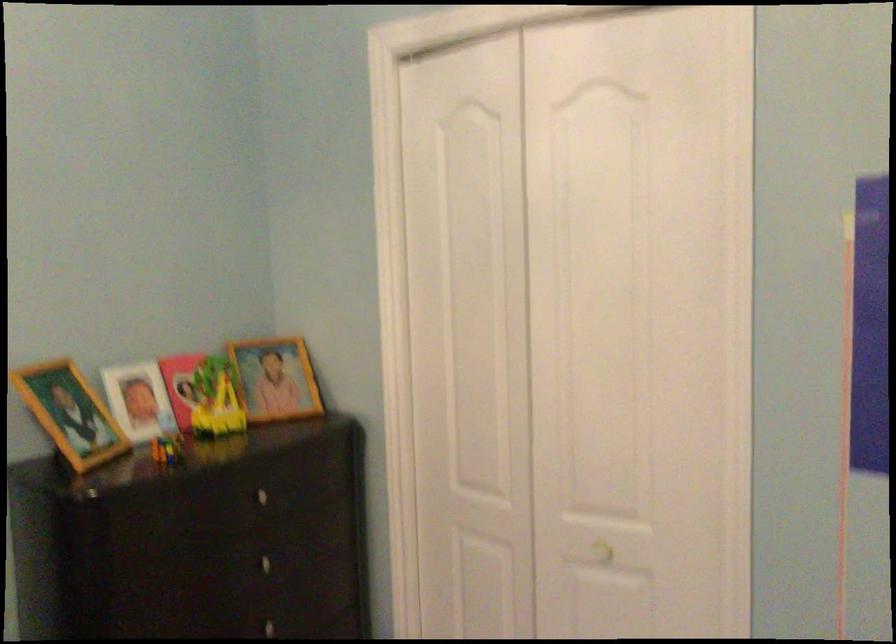
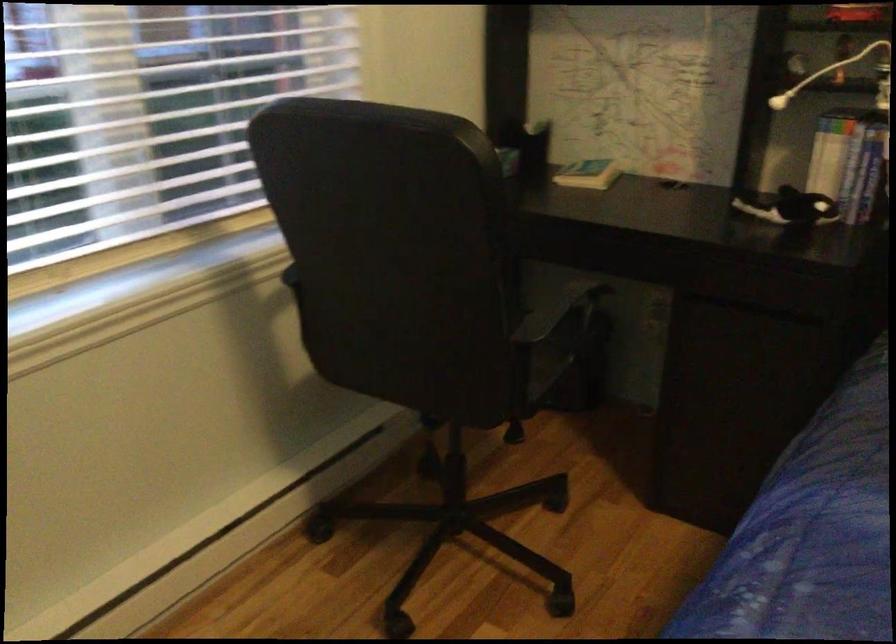
How did the camera likely rotate?

The rotation direction of the camera is left-down.